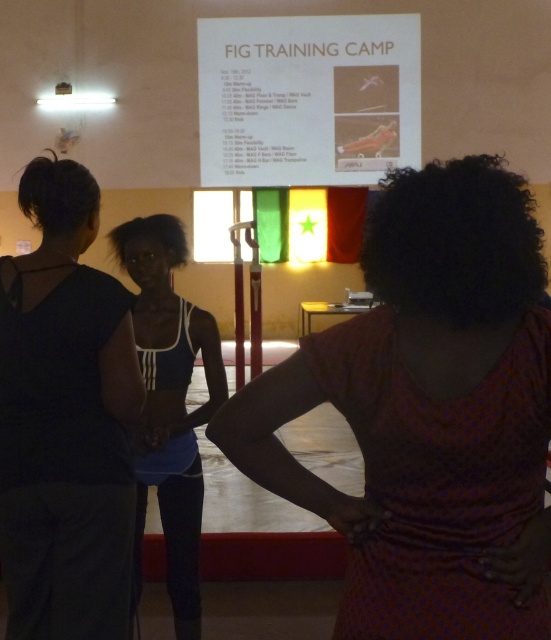
Between point (133, 515) and point (407, 140), which one is positioned in front?

Point (133, 515) is more forward.

This screenshot has height=640, width=551. Identify the location of black matte tank top at left. (64, 420).

Is printed cotton dress at center positioned in front of white matte sports bra at center?

Yes, it is in front of white matte sports bra at center.

Does point (392, 346) come closer to viewer compared to point (127, 241)?

Yes, point (392, 346) is in front of point (127, 241).

Identify the location of printed cotton dress at center. This screenshot has height=640, width=551. (429, 413).

Is printed cotton dress at center to the right of black matte tank top at left from the viewer's perspective?

Yes, printed cotton dress at center is to the right of black matte tank top at left.

The width and height of the screenshot is (551, 640). What do you see at coordinates (429, 413) in the screenshot?
I see `printed cotton dress at center` at bounding box center [429, 413].

Between point (349, 593) and point (126, 468), which one is positioned behind?

Positioned behind is point (126, 468).

Locate an element on the screen. printed cotton dress at center is located at coordinates pyautogui.click(x=429, y=413).